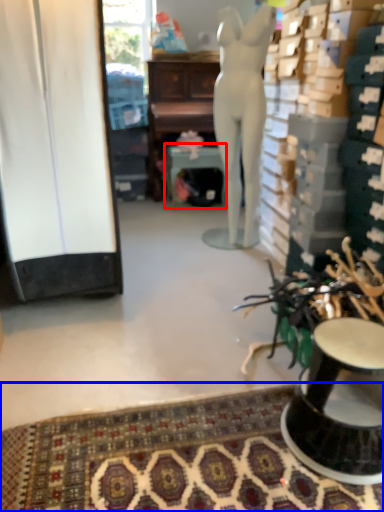
Question: Among these objects, which one is farthest to the camera, round table (highlighted by a red box) or mat (highlighted by a blue box)?

Choices:
 (A) round table
 (B) mat

Answer: (A)